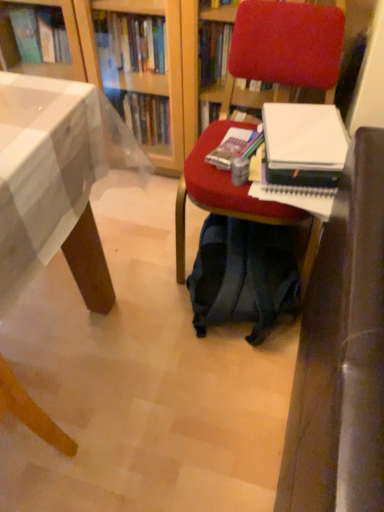
Question: Considering the relative sizes of white paper at center right and velvet red chair at center in the image provided, is white paper at center right smaller than velvet red chair at center?

Choices:
 (A) yes
 (B) no

Answer: (A)

Question: Is white paper at center right not close to velvet red chair at center?

Choices:
 (A) no
 (B) yes

Answer: (A)

Question: Can velvet red chair at center be found inside white paper at center right?

Choices:
 (A) no
 (B) yes

Answer: (A)

Question: Can you confirm if white paper at center right is thinner than velvet red chair at center?

Choices:
 (A) yes
 (B) no

Answer: (A)

Question: Is white paper at center right shorter than velvet red chair at center?

Choices:
 (A) no
 (B) yes

Answer: (B)

Question: Would you say wooden desk at lower left is to the left or to the right of white paper at center right in the picture?

Choices:
 (A) right
 (B) left

Answer: (B)

Question: Looking at their shapes, would you say wooden desk at lower left is wider or thinner than white paper at center right?

Choices:
 (A) thin
 (B) wide

Answer: (B)

Question: Is wooden desk at lower left inside the boundaries of white paper at center right, or outside?

Choices:
 (A) inside
 (B) outside

Answer: (B)

Question: Considering the positions of wooden desk at lower left and white paper at center right in the image, is wooden desk at lower left bigger or smaller than white paper at center right?

Choices:
 (A) small
 (B) big

Answer: (B)

Question: From a real-world perspective, is wooden desk at lower left above or below dark blue fabric backpack at center?

Choices:
 (A) below
 (B) above

Answer: (B)

Question: Is wooden desk at lower left spatially inside dark blue fabric backpack at center, or outside of it?

Choices:
 (A) outside
 (B) inside

Answer: (A)

Question: In terms of width, does wooden desk at lower left look wider or thinner when compared to dark blue fabric backpack at center?

Choices:
 (A) wide
 (B) thin

Answer: (B)

Question: Does point (56, 180) appear closer or farther from the camera than point (236, 233)?

Choices:
 (A) farther
 (B) closer

Answer: (B)

Question: Is velvet red chair at center bigger or smaller than wooden desk at lower left?

Choices:
 (A) big
 (B) small

Answer: (A)

Question: From the image's perspective, is velvet red chair at center positioned above or below wooden desk at lower left?

Choices:
 (A) below
 (B) above

Answer: (B)